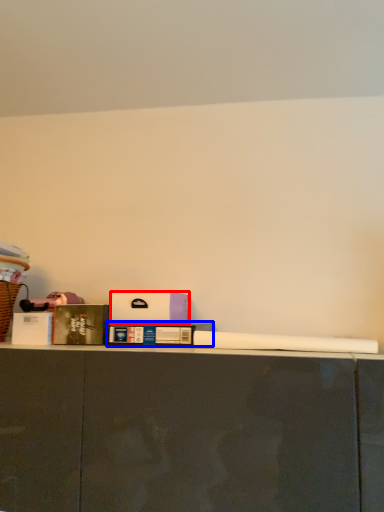
Question: Which point is closer to the camera, box (highlighted by a red box) or book (highlighted by a blue box)?

Choices:
 (A) box
 (B) book

Answer: (B)